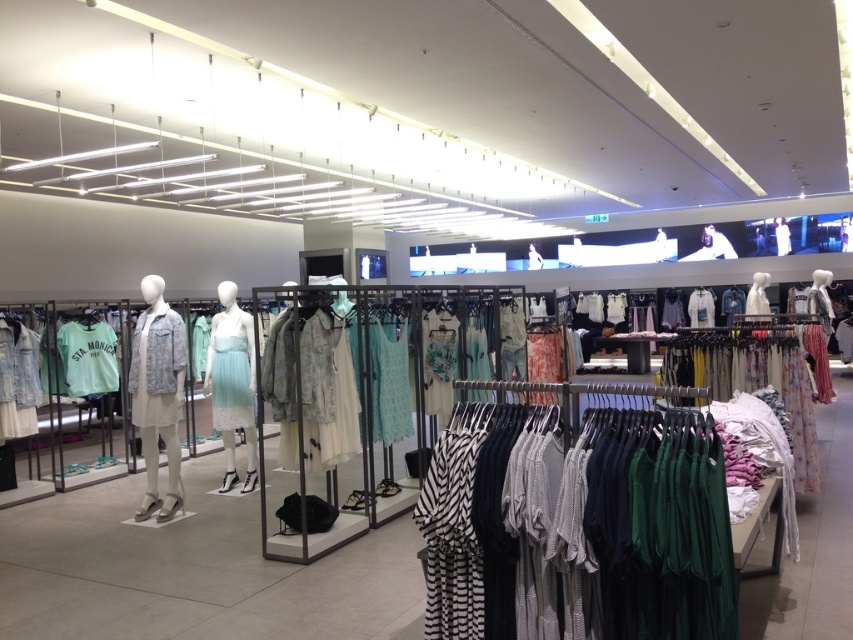
You are a customer in the store and want to see both the striped jersey dress at center and the light green jersey at left. Which one is closer to you?

The striped jersey dress at center is closer to you because it is in front of the light green jersey at left.

You are a customer in the women fashion section of a store. You see a striped jersey dress at center and a light green jersey at left. Which item is positioned lower in the store?

The striped jersey dress at center is below the light green jersey at left, so it is positioned lower.